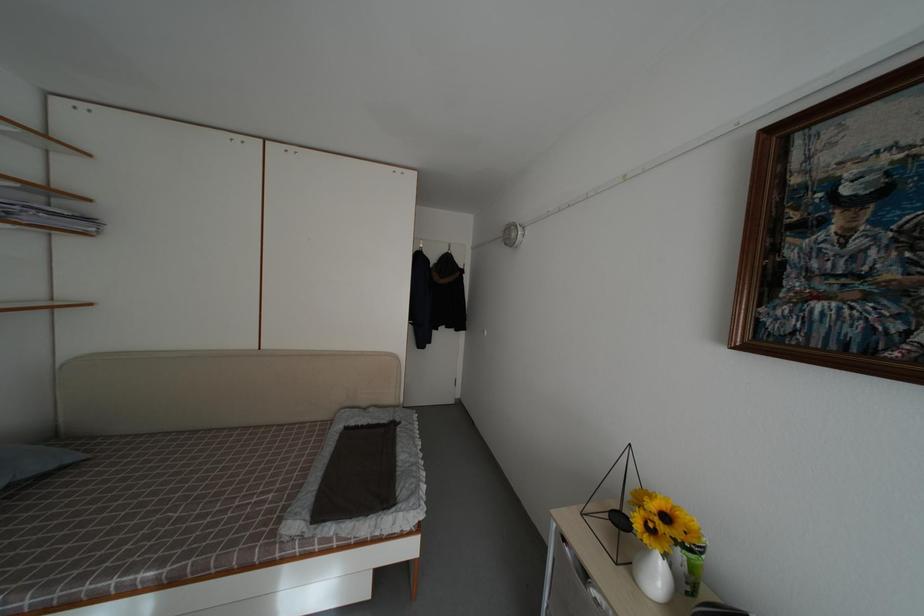
Where would you lift the black wire sculpture? Please return your answer as a coordinate pair (x, y).

(613, 509)